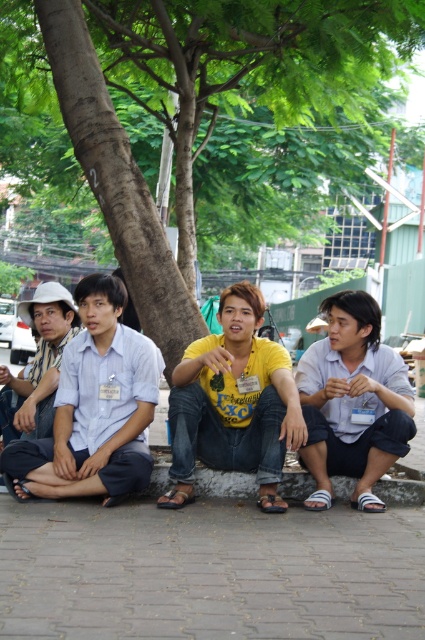
Question: Which object is the closest to the white matte shirt at center?

Choices:
 (A) brown rough tree trunk at center
 (B) yellow matte shirt at center
 (C) light blue shirt at left
 (D) gray brick pavement at lower center

Answer: (B)

Question: Does light blue shirt at left have a larger size compared to white matte shirt at center?

Choices:
 (A) yes
 (B) no

Answer: (A)

Question: Can you confirm if light blue shirt at left is wider than white matte shirt at center?

Choices:
 (A) yes
 (B) no

Answer: (A)

Question: Which point is farther to the camera?

Choices:
 (A) gray brick pavement at lower center
 (B) brown rough tree trunk at center
 (C) yellow matte shirt at center

Answer: (B)

Question: Can you confirm if gray brick pavement at lower center is smaller than light blue shirt at left?

Choices:
 (A) no
 (B) yes

Answer: (B)

Question: Estimate the real-world distances between objects in this image. Which object is closer to the brown rough tree trunk at center?

Choices:
 (A) white matte shirt at center
 (B) gray brick pavement at lower center

Answer: (B)